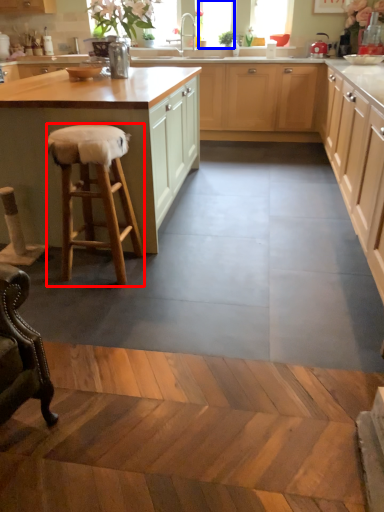
Question: Among these objects, which one is nearest to the camera, stool (highlighted by a red box) or window screen (highlighted by a blue box)?

Choices:
 (A) stool
 (B) window screen

Answer: (A)